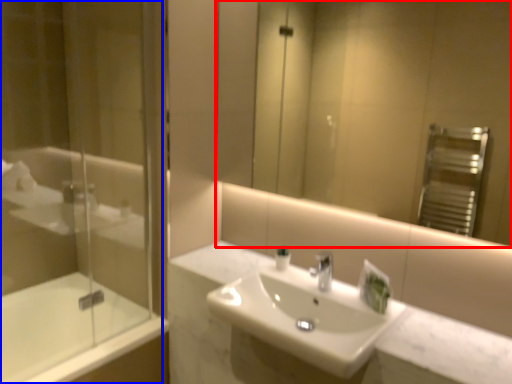
Question: Which object is further to the camera taking this photo, mirror (highlighted by a red box) or shower door (highlighted by a blue box)?

Choices:
 (A) mirror
 (B) shower door

Answer: (B)